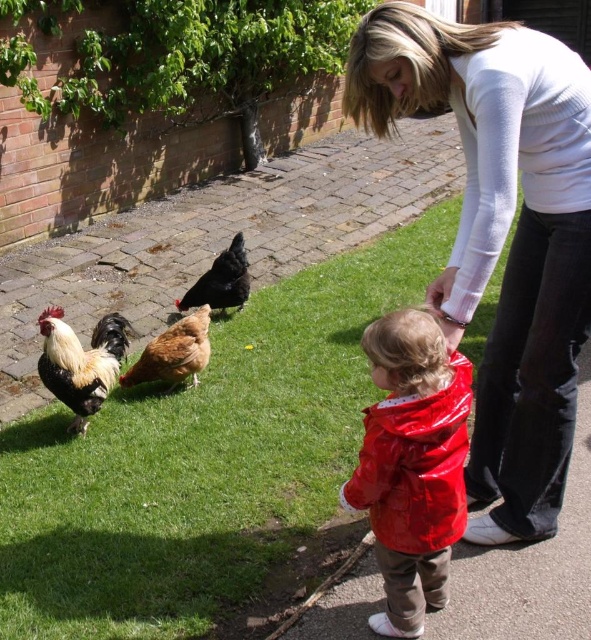
Can you confirm if green grass at lower center is taller than brown feathered chicken at center?

Yes, green grass at lower center is taller than brown feathered chicken at center.

Does green grass at lower center lie behind brown feathered chicken at center?

No, it is in front of brown feathered chicken at center.

Does point (329, 380) come in front of point (199, 323)?

No, (329, 380) is further to viewer.

In order to click on green grass at lower center in this screenshot , I will do `click(204, 461)`.

Looking at this image, can you confirm if brown feathered chicken at center is bigger than black matte chicken at center?

No.

The image size is (591, 640). In order to click on brown feathered chicken at center in this screenshot , I will do `click(173, 353)`.

Locate an element on the screen. The width and height of the screenshot is (591, 640). brown feathered chicken at center is located at coordinates (x=173, y=353).

Does shiny red raincoat at lower right lie behind golden brown feathers at center?

No, shiny red raincoat at lower right is closer to the viewer.

Between shiny red raincoat at lower right and golden brown feathers at center, which one appears on the right side from the viewer's perspective?

shiny red raincoat at lower right is more to the right.

Is point (375, 627) in front of point (43, 380)?

Yes, it is.

Find the location of a particular element. Image resolution: width=591 pixels, height=640 pixels. shiny red raincoat at lower right is located at coordinates (413, 465).